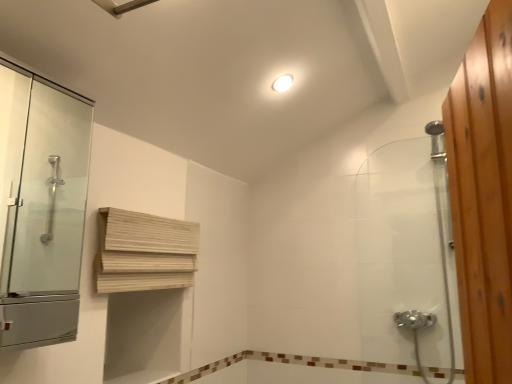
Question: Is transparent glass shower door at left surrounding brown mosaic tile at lower center?

Choices:
 (A) yes
 (B) no

Answer: (B)

Question: Considering the relative sizes of transparent glass shower door at left and brown mosaic tile at lower center in the image provided, is transparent glass shower door at left taller than brown mosaic tile at lower center?

Choices:
 (A) no
 (B) yes

Answer: (B)

Question: Does transparent glass shower door at left lie behind brown mosaic tile at lower center?

Choices:
 (A) no
 (B) yes

Answer: (A)

Question: Can you confirm if transparent glass shower door at left is positioned to the right of brown mosaic tile at lower center?

Choices:
 (A) no
 (B) yes

Answer: (A)

Question: From a real-world perspective, is transparent glass shower door at left under brown mosaic tile at lower center?

Choices:
 (A) no
 (B) yes

Answer: (A)

Question: In the image, is white glossy light fixture at upper center positioned in front of or behind brown mosaic tile at lower center?

Choices:
 (A) behind
 (B) front

Answer: (B)

Question: Considering the positions of white glossy light fixture at upper center and brown mosaic tile at lower center in the image, is white glossy light fixture at upper center taller or shorter than brown mosaic tile at lower center?

Choices:
 (A) tall
 (B) short

Answer: (A)

Question: Does point (290, 79) appear closer or farther from the camera than point (446, 370)?

Choices:
 (A) farther
 (B) closer

Answer: (B)

Question: Choose the correct answer: Is white glossy light fixture at upper center inside brown mosaic tile at lower center or outside it?

Choices:
 (A) outside
 (B) inside

Answer: (A)

Question: Considering the positions of point (410, 302) and point (144, 286), is point (410, 302) closer or farther from the camera than point (144, 286)?

Choices:
 (A) farther
 (B) closer

Answer: (A)

Question: Considering the positions of clear glass shower door at right and light wood/wooden shelf at upper center in the image, is clear glass shower door at right taller or shorter than light wood/wooden shelf at upper center?

Choices:
 (A) short
 (B) tall

Answer: (B)

Question: From a real-world perspective, is clear glass shower door at right positioned above or below light wood/wooden shelf at upper center?

Choices:
 (A) below
 (B) above

Answer: (B)

Question: Is clear glass shower door at right wider or thinner than light wood/wooden shelf at upper center?

Choices:
 (A) wide
 (B) thin

Answer: (A)

Question: Is light wood/wooden shelf at upper center bigger or smaller than brown mosaic tile at lower center?

Choices:
 (A) big
 (B) small

Answer: (A)

Question: Based on their positions, is light wood/wooden shelf at upper center located to the left or right of brown mosaic tile at lower center?

Choices:
 (A) left
 (B) right

Answer: (A)